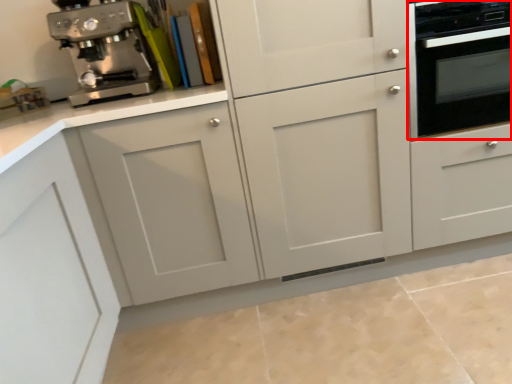
Question: Considering the relative positions of home appliance (annotated by the red box) and coffee maker in the image provided, where is home appliance (annotated by the red box) located with respect to the staircase?

Choices:
 (A) left
 (B) right

Answer: (B)